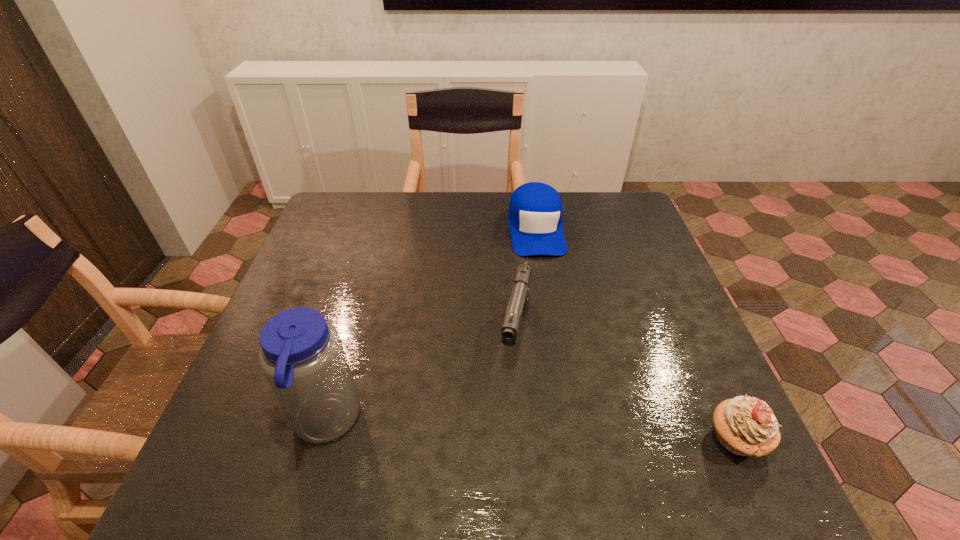
Where is `vacant space on the desktop that is between the tallest object and the rightmost object and is positioned in the direction the gun is aimed`? Image resolution: width=960 pixels, height=540 pixels. vacant space on the desktop that is between the tallest object and the rightmost object and is positioned in the direction the gun is aimed is located at coordinates (492, 429).

The image size is (960, 540). What are the coordinates of `free space on the desktop that is between the leftmost object and the rightmost object and is positioned on the front-facing side of the baseball cap` in the screenshot? It's located at (572, 433).